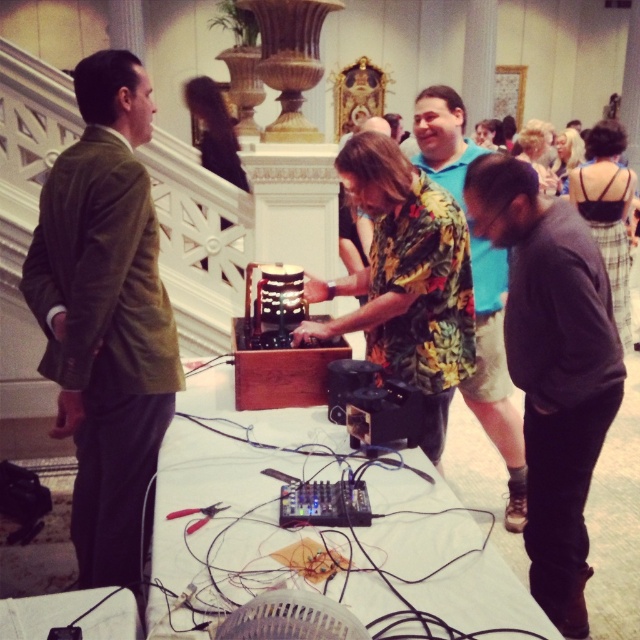
Does green velvet suit at left come in front of black plastic table at center?

No, green velvet suit at left is further to the viewer.

You are a GUI agent. You are given a task and a screenshot of the screen. Output one action in this format:
    pyautogui.click(x=<x>, y=<y>)
    Task: Click on the green velvet suit at left
    The height and width of the screenshot is (640, 640).
    Given the screenshot: What is the action you would take?
    pyautogui.click(x=106, y=317)

The image size is (640, 640). Find the location of `green velvet suit at left`. green velvet suit at left is located at coordinates coord(106,317).

Measure the distance between black plastic table at center and camera.

4.35 feet

Who is taller, black plastic table at center or blonde hair at center?

blonde hair at center is taller.

Is point (257, 504) positioned after point (538, 172)?

No, (257, 504) is in front of (538, 172).

I want to click on black plastic table at center, so click(x=230, y=490).

Is floral print shirt at center positioned at the back of floral shirt at center?

No.

Is floral print shirt at center wider than floral shirt at center?

Correct, the width of floral print shirt at center exceeds that of floral shirt at center.

Identify the location of floral print shirt at center. (404, 280).